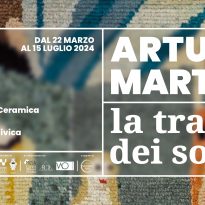
Identify the location of brick wall background. The height and width of the screenshot is (205, 205). (174, 194), (38, 190), (54, 14), (173, 12).